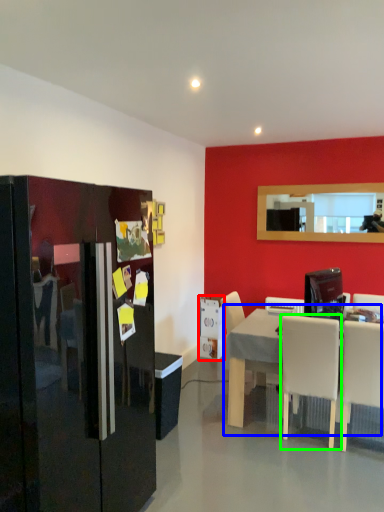
Question: Which object is positioned closest to appliance (highlighted by a red box)? Select from table (highlighted by a blue box) and chair (highlighted by a green box).

Choices:
 (A) table
 (B) chair

Answer: (A)